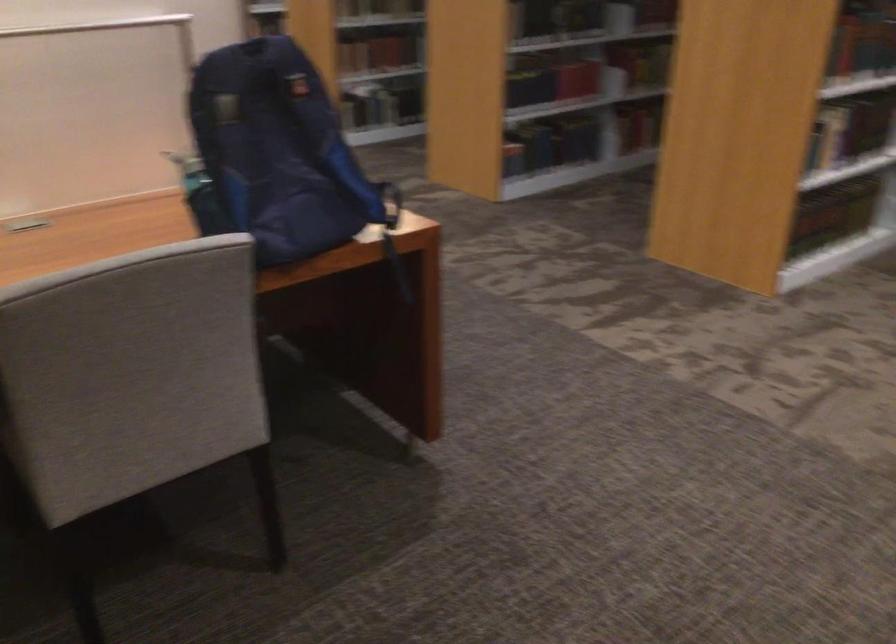
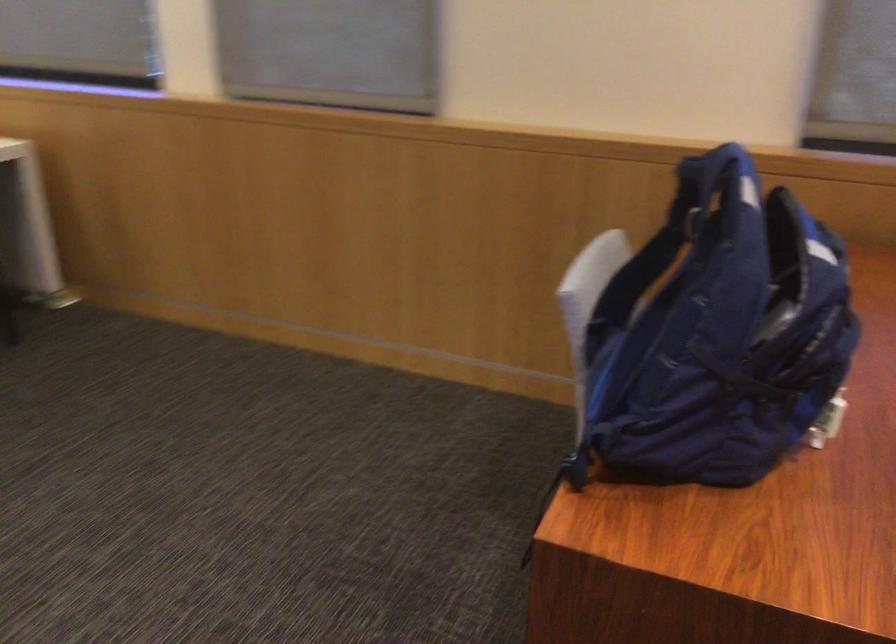
Find the pixel in the second image that matches [289,80] in the first image.

(687, 216)